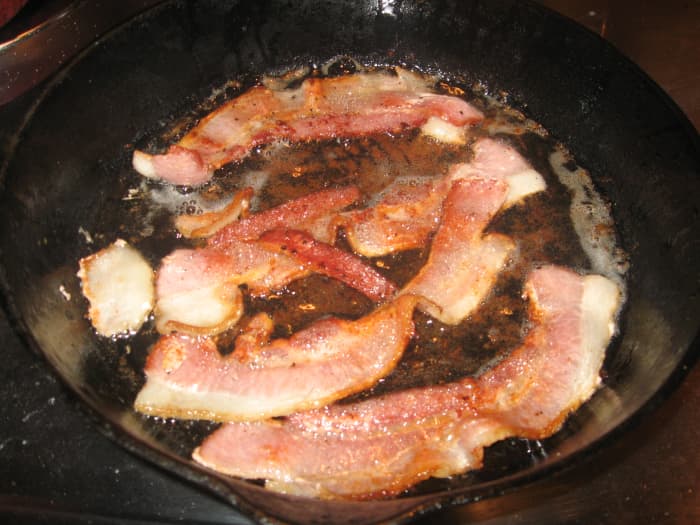
Locate an element on the screen. table is located at coordinates (638, 23).